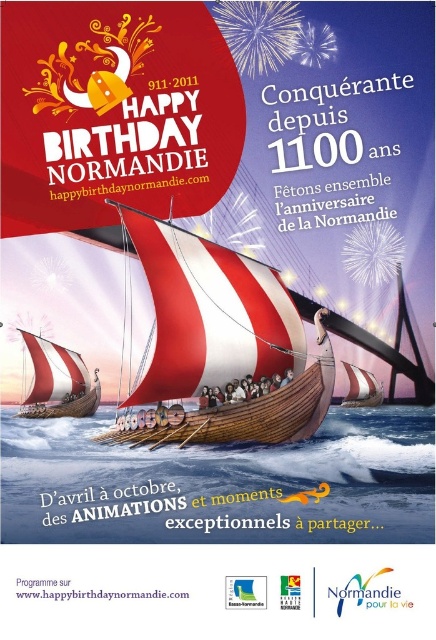
You are an observer looking at the poster. There is a wooden viking ship at center and a white striped sailboat at center. Which one is positioned more towards the right side?

The wooden viking ship at center is positioned more towards the right side than the white striped sailboat at center.